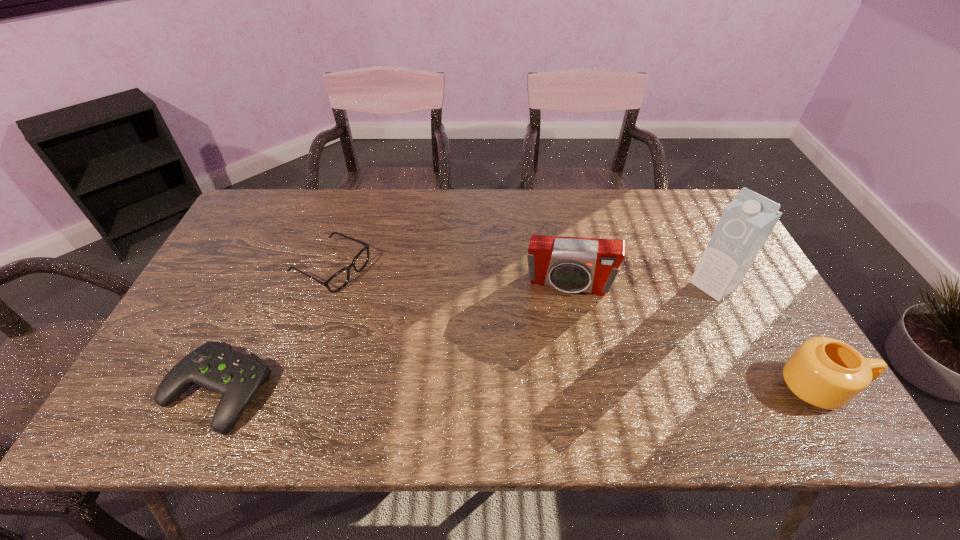
Where is `free space that satisfies the following two spatial constraints: 1. on the front side of the camera; 2. on the left side of the spectacles`? This screenshot has width=960, height=540. free space that satisfies the following two spatial constraints: 1. on the front side of the camera; 2. on the left side of the spectacles is located at coordinates (326, 284).